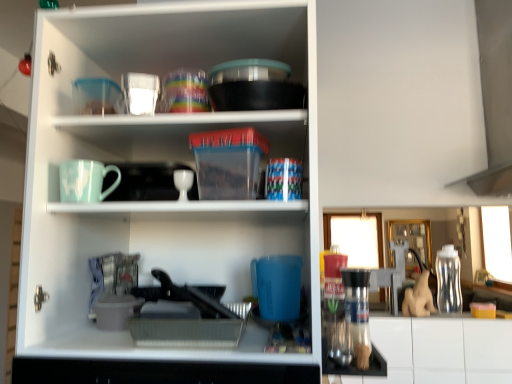
The height and width of the screenshot is (384, 512). In order to click on matte ceramic mug at upper left in this screenshot , I will do `click(85, 181)`.

What do you see at coordinates (85, 181) in the screenshot? Image resolution: width=512 pixels, height=384 pixels. I see `matte ceramic mug at upper left` at bounding box center [85, 181].

Identify the location of transparent glass cup at upper center, acting as the 2th tableware starting from the top. (140, 92).

I want to click on transparent plastic bottle at right, so (x=448, y=280).

You are a GUI agent. You are given a task and a screenshot of the screen. Output one action in this format:
    pyautogui.click(x=<x>, y=<y>)
    Task: Click on the matte ceramic mug at upper left
    This screenshot has height=384, width=512.
    Given the screenshot: What is the action you would take?
    pyautogui.click(x=85, y=181)

Is transparent plastic bottle at right at the back of transparent glass cup at upper center, acting as the 2th tableware starting from the top?

That's not correct — transparent glass cup at upper center, acting as the 2th tableware starting from the top, is not looking away from transparent plastic bottle at right.

Between transparent glass cup at upper center, placed as the 2th tableware when sorted from bottom to top, and transparent plastic bottle at right, which one has larger size?

Bigger between the two is transparent plastic bottle at right.

From the picture: From the image's perspective, who appears lower, transparent glass cup at upper center, placed as the 2th tableware when sorted from bottom to top, or transparent plastic bottle at right?

From the image's view, transparent plastic bottle at right is below.

Consider the image. Is gray plastic tray at lower center closer to camera compared to matte ceramic mug at upper left?

Yes, gray plastic tray at lower center is closer to the camera.

Is the surface of gray plastic tray at lower center in direct contact with matte ceramic mug at upper left?

No, gray plastic tray at lower center is not making contact with matte ceramic mug at upper left.

From the image's perspective, is gray plastic tray at lower center on top of matte ceramic mug at upper left?

No.

At what (x,y) coordinates should I click in order to perform the action: click on mug that is above the gray plastic tray at lower center (from the image's perspective). Please return your answer as a coordinate pair (x, y). The width and height of the screenshot is (512, 384). Looking at the image, I should click on (85, 181).

Find the location of a particular element. This screenshot has width=512, height=384. the 2nd tableware below the translucent plastic cups at upper center, which appears as the 1th tableware when viewed from the top (from the image's perspective) is located at coordinates (183, 183).

Considering the sizes of objects translucent plastic cups at upper center, which appears as the 1th tableware when viewed from the top, and white glossy egg cup at center, which is the 3th tableware from top to bottom, in the image provided, who is shorter, translucent plastic cups at upper center, which appears as the 1th tableware when viewed from the top, or white glossy egg cup at center, which is the 3th tableware from top to bottom,?

white glossy egg cup at center, which is the 3th tableware from top to bottom, is shorter.

Based on the photo, based on their sizes in the image, would you say translucent plastic cups at upper center, the 3th tableware ordered from the bottom, is bigger or smaller than white glossy egg cup at center, arranged as the 1th tableware when ordered from the bottom?

In the image, translucent plastic cups at upper center, the 3th tableware ordered from the bottom, appears to be larger than white glossy egg cup at center, arranged as the 1th tableware when ordered from the bottom.

Considering the relative positions of gray plastic tray at lower center and transparent glass cup at upper center, placed as the 2th tableware when sorted from bottom to top, in the image provided, is gray plastic tray at lower center to the right of transparent glass cup at upper center, placed as the 2th tableware when sorted from bottom to top, from the viewer's perspective?

Correct, you'll find gray plastic tray at lower center to the right of transparent glass cup at upper center, placed as the 2th tableware when sorted from bottom to top.

From the image's perspective, would you say gray plastic tray at lower center is shown under transparent glass cup at upper center, acting as the 2th tableware starting from the top?

Indeed, from the image's perspective, gray plastic tray at lower center is shown beneath transparent glass cup at upper center, acting as the 2th tableware starting from the top.

Does gray plastic tray at lower center have a greater width compared to transparent glass cup at upper center, acting as the 2th tableware starting from the top?

Correct, the width of gray plastic tray at lower center exceeds that of transparent glass cup at upper center, acting as the 2th tableware starting from the top.

Considering the relative sizes of gray plastic tray at lower center and transparent glass cup at upper center, placed as the 2th tableware when sorted from bottom to top, in the image provided, is gray plastic tray at lower center taller than transparent glass cup at upper center, placed as the 2th tableware when sorted from bottom to top,?

In fact, gray plastic tray at lower center may be shorter than transparent glass cup at upper center, placed as the 2th tableware when sorted from bottom to top.

Which object is thinner, white glossy egg cup at center, arranged as the 1th tableware when ordered from the bottom, or transparent plastic bottle at right?

Thinner between the two is white glossy egg cup at center, arranged as the 1th tableware when ordered from the bottom.

Which of these two, white glossy egg cup at center, arranged as the 1th tableware when ordered from the bottom, or transparent plastic bottle at right, is smaller?

white glossy egg cup at center, arranged as the 1th tableware when ordered from the bottom.

From a real-world perspective, is white glossy egg cup at center, which is the 3th tableware from top to bottom, on top of transparent plastic bottle at right?

Correct, in the physical world, white glossy egg cup at center, which is the 3th tableware from top to bottom, is higher than transparent plastic bottle at right.

Is gray plastic tray at lower center oriented away from white glossy egg cup at center, which is the 3th tableware from top to bottom?

No, gray plastic tray at lower center is not facing away from white glossy egg cup at center, which is the 3th tableware from top to bottom.

From a real-world perspective, is gray plastic tray at lower center positioned above or below white glossy egg cup at center, arranged as the 1th tableware when ordered from the bottom?

Clearly, from a real-world perspective, gray plastic tray at lower center is below white glossy egg cup at center, arranged as the 1th tableware when ordered from the bottom.

Does point (143, 324) come closer to viewer compared to point (183, 188)?

Yes, it is.

The image size is (512, 384). What are the coordinates of `appliance beneath the white glossy egg cup at center, arranged as the 1th tableware when ordered from the bottom (from a real-world perspective)` in the screenshot? It's located at (188, 319).

From the picture: Is white glossy egg cup at center, arranged as the 1th tableware when ordered from the bottom, positioned beyond the bounds of matte ceramic mug at upper left?

Indeed, white glossy egg cup at center, arranged as the 1th tableware when ordered from the bottom, is completely outside matte ceramic mug at upper left.

Who is smaller, white glossy egg cup at center, which is the 3th tableware from top to bottom, or matte ceramic mug at upper left?

white glossy egg cup at center, which is the 3th tableware from top to bottom, is smaller.

Looking at this image, which object is closer to the camera, white glossy egg cup at center, which is the 3th tableware from top to bottom, or matte ceramic mug at upper left?

matte ceramic mug at upper left is in front.

The height and width of the screenshot is (384, 512). What are the coordinates of `bottle that appears behind the transparent glass cup at upper center, placed as the 2th tableware when sorted from bottom to top` in the screenshot? It's located at (448, 280).

This screenshot has height=384, width=512. Identify the location of appliance below the matte ceramic mug at upper left (from the image's perspective). (188, 319).

Estimate the real-world distances between objects in this image. Which object is closer to translucent plastic cups at upper center, the 3th tableware ordered from the bottom, transparent plastic bottle at right or gray plastic tray at lower center?

Among the two, gray plastic tray at lower center is located nearer to translucent plastic cups at upper center, the 3th tableware ordered from the bottom.

Which object lies nearer to the anchor point transparent glass cup at upper center, acting as the 2th tableware starting from the top, translucent plastic cups at upper center, which appears as the 1th tableware when viewed from the top, or white glossy egg cup at center, arranged as the 1th tableware when ordered from the bottom?

translucent plastic cups at upper center, which appears as the 1th tableware when viewed from the top, lies closer to transparent glass cup at upper center, acting as the 2th tableware starting from the top, than the other object.

Which object lies nearer to the anchor point translucent plastic cups at upper center, the 3th tableware ordered from the bottom, white glossy egg cup at center, arranged as the 1th tableware when ordered from the bottom, or transparent plastic bottle at right?

Based on the image, white glossy egg cup at center, arranged as the 1th tableware when ordered from the bottom, appears to be nearer to translucent plastic cups at upper center, the 3th tableware ordered from the bottom.

From the image, which object appears to be farther from transparent plastic bottle at right, white glossy egg cup at center, which is the 3th tableware from top to bottom, or gray plastic tray at lower center?

white glossy egg cup at center, which is the 3th tableware from top to bottom, is positioned further to the anchor transparent plastic bottle at right.

Based on their spatial positions, is transparent plastic bottle at right or transparent glass cup at upper center, acting as the 2th tableware starting from the top, closer to matte ceramic mug at upper left?

transparent glass cup at upper center, acting as the 2th tableware starting from the top, is closer to matte ceramic mug at upper left.

From the image, which object appears to be nearer to gray plastic tray at lower center, matte ceramic mug at upper left or translucent plastic cups at upper center, which appears as the 1th tableware when viewed from the top?

Based on the image, matte ceramic mug at upper left appears to be nearer to gray plastic tray at lower center.

Based on their spatial positions, is translucent plastic cups at upper center, which appears as the 1th tableware when viewed from the top, or transparent glass cup at upper center, acting as the 2th tableware starting from the top, closer to transparent plastic bottle at right?

translucent plastic cups at upper center, which appears as the 1th tableware when viewed from the top, is closer to transparent plastic bottle at right.

Based on the photo, when comparing their distances from white glossy egg cup at center, which is the 3th tableware from top to bottom, does matte ceramic mug at upper left or translucent plastic cups at upper center, which appears as the 1th tableware when viewed from the top, seem further?

translucent plastic cups at upper center, which appears as the 1th tableware when viewed from the top, is further to white glossy egg cup at center, which is the 3th tableware from top to bottom.

At what (x,y) coordinates should I click in order to perform the action: click on tableware between white glossy egg cup at center, arranged as the 1th tableware when ordered from the bottom, and transparent plastic bottle at right from left to right. Please return your answer as a coordinate pair (x, y). Image resolution: width=512 pixels, height=384 pixels. Looking at the image, I should click on (185, 92).

You are a GUI agent. You are given a task and a screenshot of the screen. Output one action in this format:
    pyautogui.click(x=<x>, y=<y>)
    Task: Click on the appliance located between matte ceramic mug at upper left and transparent plastic bottle at right in the left-right direction
    The height and width of the screenshot is (384, 512).
    Given the screenshot: What is the action you would take?
    pyautogui.click(x=188, y=319)

Where is `mug between transparent glass cup at upper center, acting as the 2th tableware starting from the top, and gray plastic tray at lower center, in the vertical direction`? The height and width of the screenshot is (384, 512). mug between transparent glass cup at upper center, acting as the 2th tableware starting from the top, and gray plastic tray at lower center, in the vertical direction is located at coordinates (85, 181).

I want to click on tableware that lies between transparent glass cup at upper center, acting as the 2th tableware starting from the top, and gray plastic tray at lower center from top to bottom, so click(x=183, y=183).